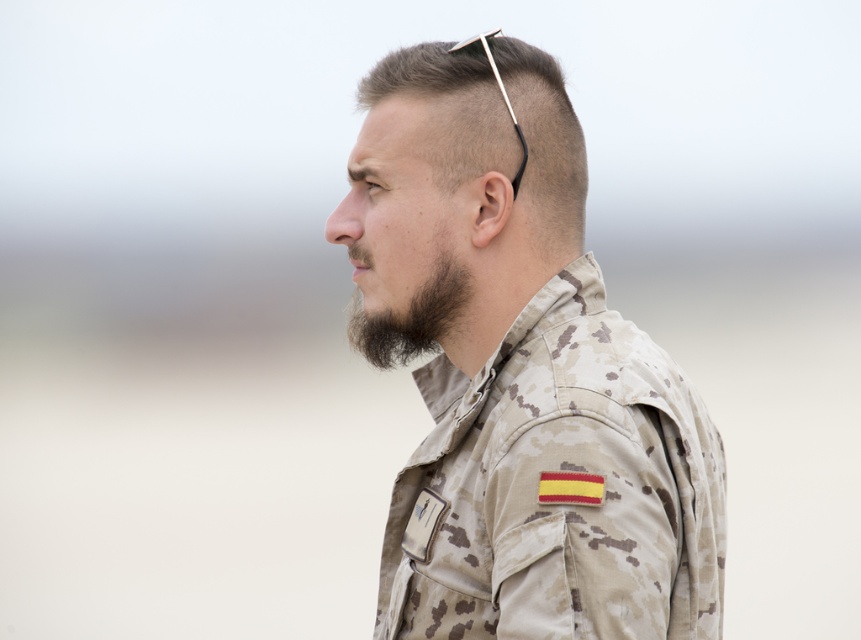
Is camouflage uniform at center to the left of camouflage fabric head at center from the viewer's perspective?

In fact, camouflage uniform at center is to the right of camouflage fabric head at center.

Identify the location of camouflage uniform at center. (518, 371).

Identify the location of camouflage uniform at center. This screenshot has height=640, width=861. (518, 371).

Which is more to the left, camouflage uniform at center or dark brown fuzzy beard at lower left?

dark brown fuzzy beard at lower left

You are a GUI agent. You are given a task and a screenshot of the screen. Output one action in this format:
    pyautogui.click(x=<x>, y=<y>)
    Task: Click on the camouflage uniform at center
    The width and height of the screenshot is (861, 640).
    Given the screenshot: What is the action you would take?
    click(x=518, y=371)

Which is behind, point (494, 352) or point (397, 326)?

Positioned behind is point (397, 326).

The width and height of the screenshot is (861, 640). What are the coordinates of `camouflage uniform at center` in the screenshot? It's located at point(518,371).

Is camouflage fabric head at center positioned in front of dark brown fuzzy beard at lower left?

Yes, camouflage fabric head at center is in front of dark brown fuzzy beard at lower left.

Who is lower down, camouflage fabric head at center or dark brown fuzzy beard at lower left?

dark brown fuzzy beard at lower left is below.

Find the location of a particular element. The width and height of the screenshot is (861, 640). camouflage fabric head at center is located at coordinates (457, 196).

The width and height of the screenshot is (861, 640). In order to click on camouflage fabric head at center in this screenshot , I will do `click(457, 196)`.